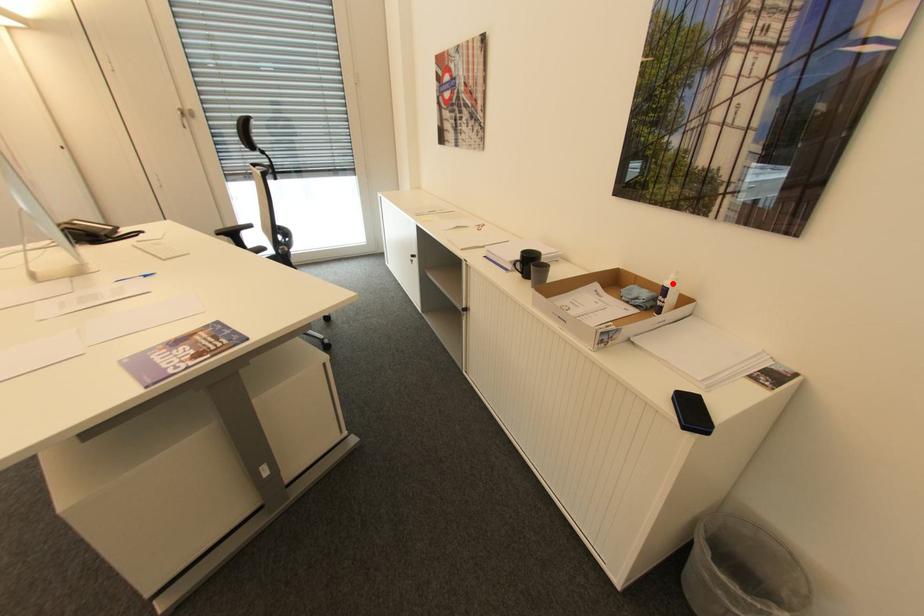
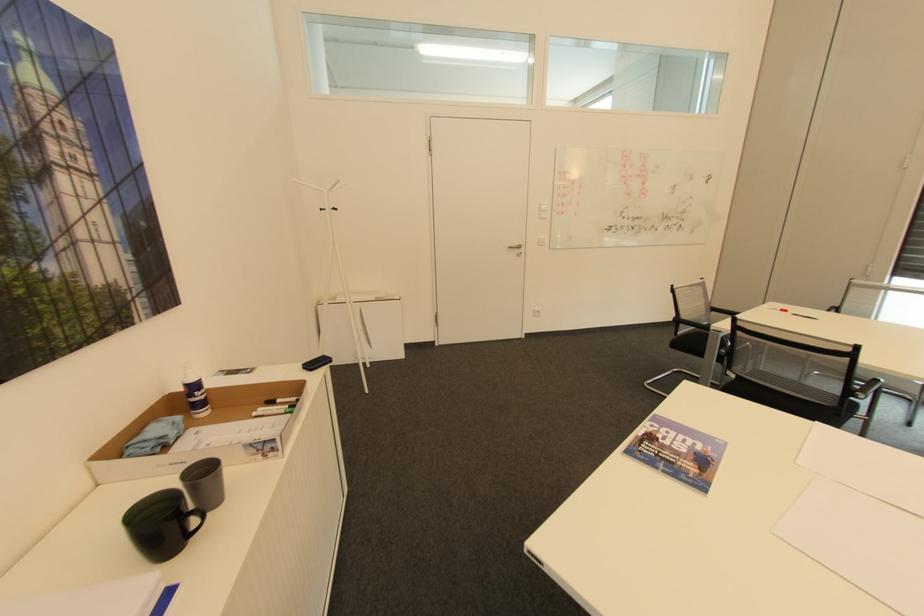
Where in the second image is the point corresponding to the highlighted location from the first image?

(197, 379)